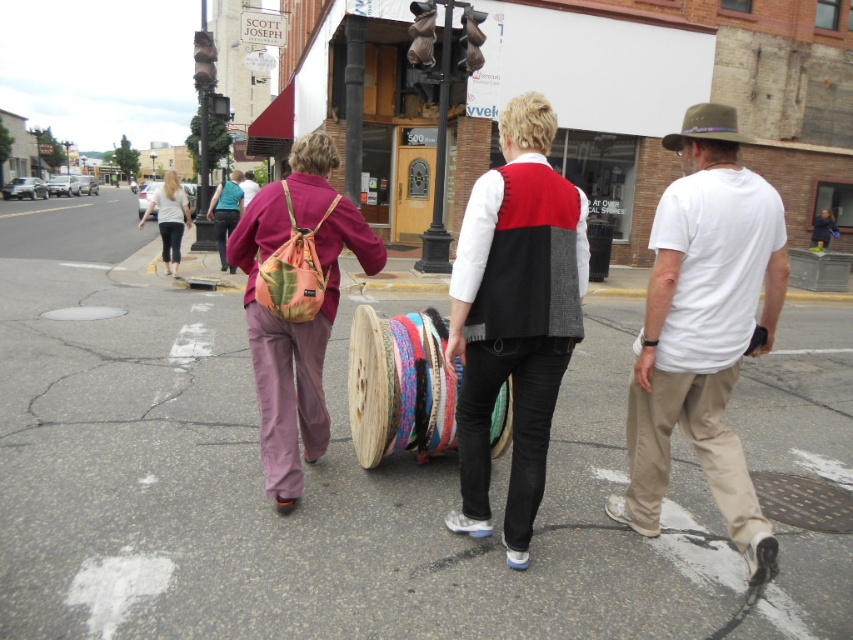
Does gray asphalt road at center appear over red and black sweater vest at center?

No.

Is point (608, 410) closer to viewer compared to point (544, 356)?

No.

Identify the location of gray asphalt road at center. (303, 492).

Locate an element on the screen. The width and height of the screenshot is (853, 640). red and black sweater vest at center is located at coordinates (514, 316).

Is point (531, 161) positioned before point (175, 269)?

Yes, point (531, 161) is closer to viewer.

In order to click on red and black sweater vest at center in this screenshot , I will do `click(514, 316)`.

Is point (724, 461) positioned after point (218, 218)?

No, it is not.

Which is above, white cotton t-shirt at center or teal fabric shirt at center?

teal fabric shirt at center is higher up.

Between point (738, 186) and point (242, 196), which one is positioned in front?

Point (738, 186) is more forward.

At what (x,y) coordinates should I click in order to perform the action: click on white cotton t-shirt at center. Please return your answer as a coordinate pair (x, y). Looking at the image, I should click on (704, 330).